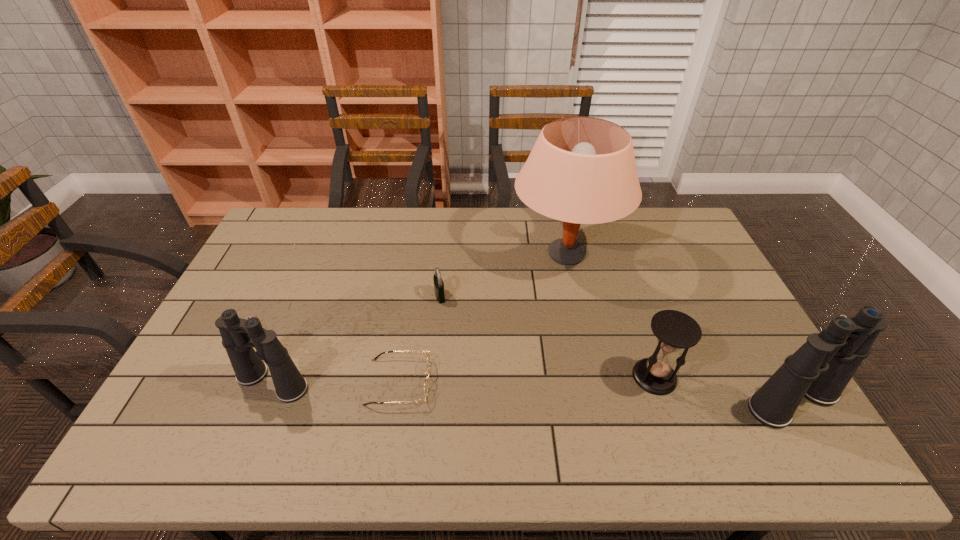
Locate an element on the screen. The image size is (960, 540). object that is at the right edge is located at coordinates (821, 368).

Locate an element on the screen. The height and width of the screenshot is (540, 960). object at the near left corner is located at coordinates (239, 336).

Find the location of a particular element. object located at the near right corner is located at coordinates (821, 368).

Where is `blank space at the far edge`? blank space at the far edge is located at coordinates (592, 243).

At what (x,y) coordinates should I click in order to perform the action: click on vacant space at the near edge. Please return your answer as a coordinate pair (x, y). This screenshot has height=540, width=960. Looking at the image, I should click on (346, 404).

In the image, there is a desktop. Where is `free region at the left edge`? The image size is (960, 540). free region at the left edge is located at coordinates (258, 271).

Locate an element on the screen. The width and height of the screenshot is (960, 540). free location at the right edge of the desktop is located at coordinates (755, 387).

Identify the location of vacant space at the near right corner of the desktop. The image size is (960, 540). (732, 395).

Find the location of `free space between the padlock and the taller binoculars`. free space between the padlock and the taller binoculars is located at coordinates (616, 348).

At what (x,y) coordinates should I click in order to perform the action: click on free space between the padlock and the third tallest object. Please return your answer as a coordinate pair (x, y). This screenshot has width=960, height=540. Looking at the image, I should click on (356, 339).